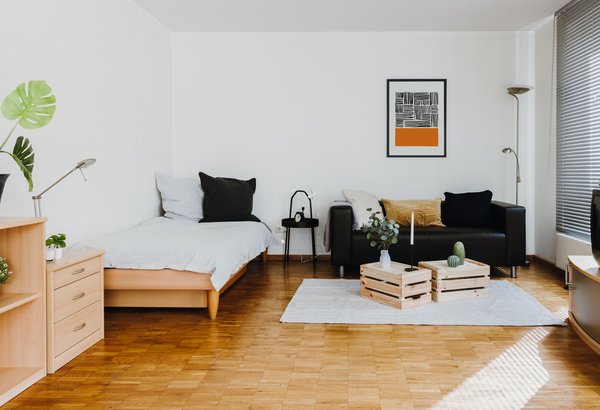
Find the location of `bed`. bed is located at coordinates (179, 247).